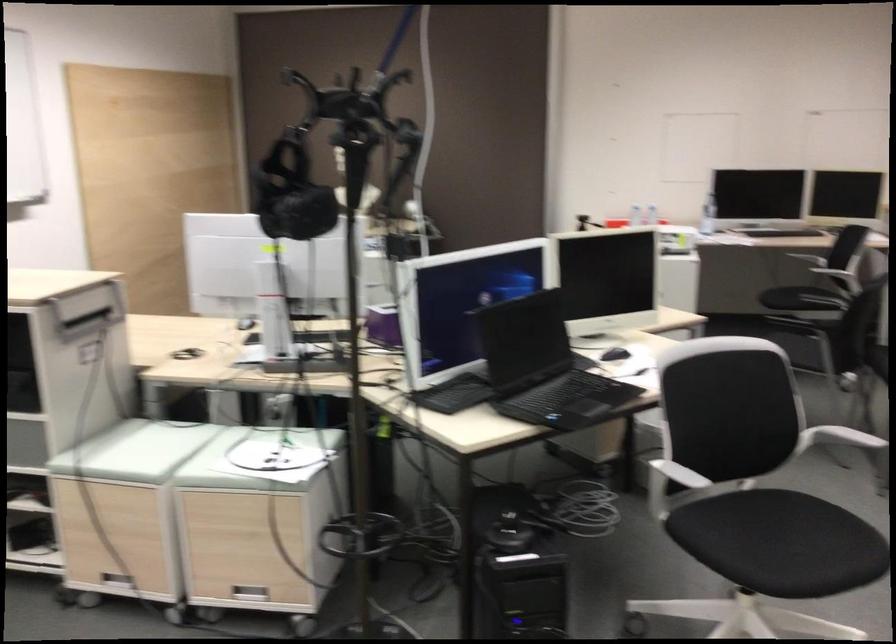
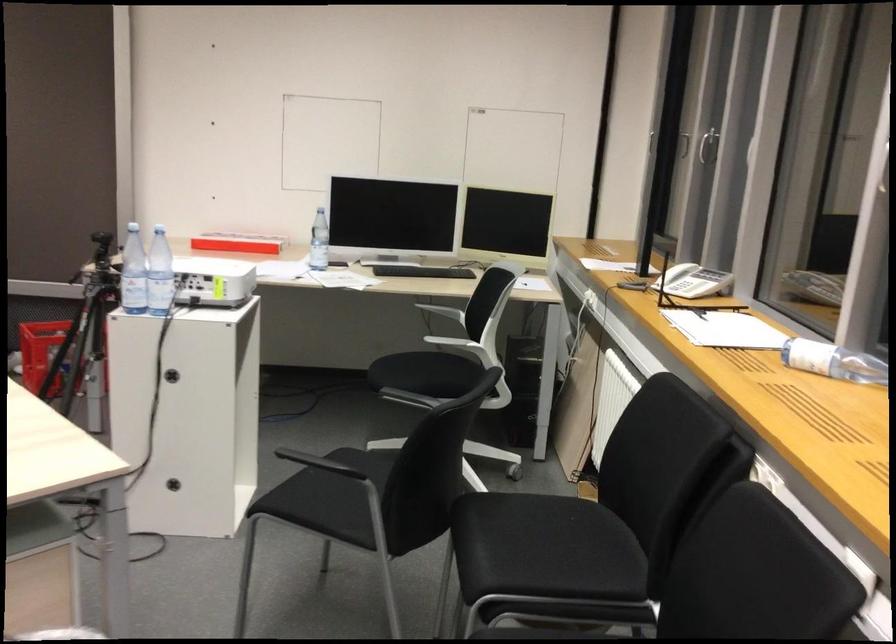
The images are taken continuously from a first-person perspective. In which direction are you moving?

The movement direction of the cameraman is right, forward.